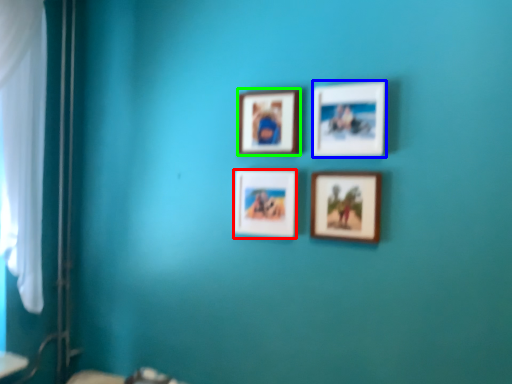
Question: Which object is positioned farthest from picture frame (highlighted by a red box)? Select from picture frame (highlighted by a blue box) and picture frame (highlighted by a green box).

Choices:
 (A) picture frame
 (B) picture frame

Answer: (A)